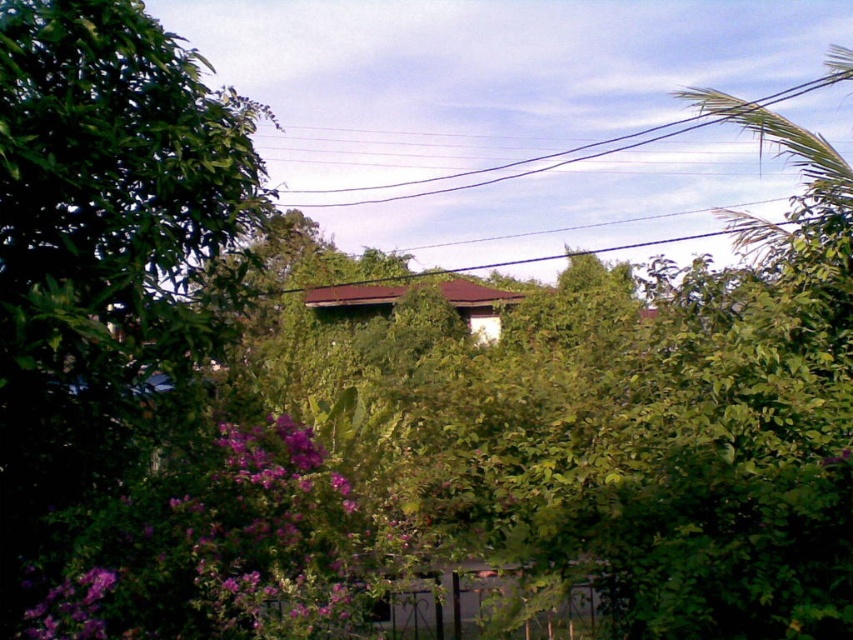
Question: Which point appears farthest from the camera in this image?

Choices:
 (A) (91, 570)
 (B) (746, 104)

Answer: (B)

Question: Can you confirm if black wire at upper center is positioned below purple matte flower at lower left?

Choices:
 (A) yes
 (B) no

Answer: (B)

Question: Which point is closer to the camera taking this photo?

Choices:
 (A) (48, 637)
 (B) (466, 182)

Answer: (A)

Question: Does black wire at upper center appear on the left side of purple matte flower at lower left?

Choices:
 (A) yes
 (B) no

Answer: (B)

Question: From the image, what is the correct spatial relationship of black wire at upper center in relation to purple matte flower at lower left?

Choices:
 (A) left
 (B) right

Answer: (B)

Question: Which point appears farthest from the camera in this image?

Choices:
 (A) (94, 637)
 (B) (641, 132)

Answer: (B)